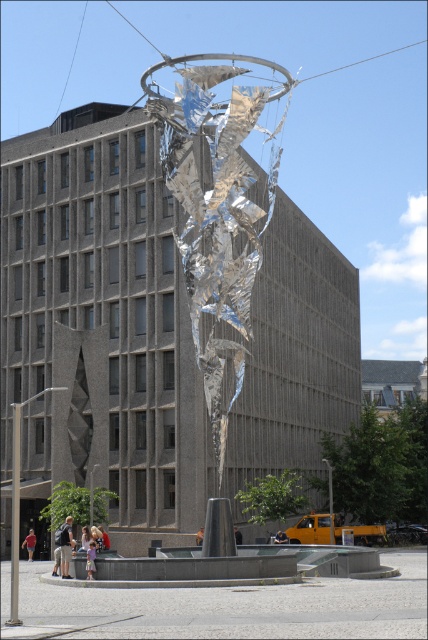
You are an artist preparing to photograph the light purple cotton dress at lower center and the light brown leather jacket at center. Which item should you focus on first if you want to capture both in a single shot without moving the camera?

You should focus on the light brown leather jacket at center first because it is lower in the frame than the light purple cotton dress at lower center, allowing you to adjust your composition to include both items without moving the camera.

You are an art installer setting up a display in front of the sculpture. You have two jackets, the light brown leather jacket at center and the dark brown leather jacket at center. Which jacket should you place on the lower part of the sculpture to complement the kinetic art installation?

The light brown leather jacket at center is below the dark brown leather jacket at center, so to place a jacket on the lower part of the sculpture, you should choose the light brown leather jacket at center.